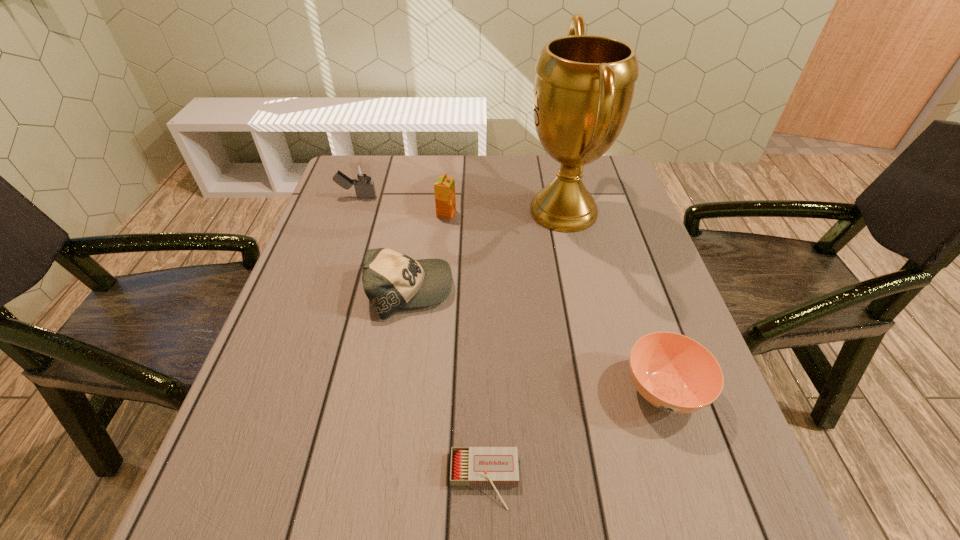
At what (x,y) coordinates should I click in order to perform the action: click on vacant position located on the back of the orange juice. Please return your answer as a coordinate pair (x, y). The height and width of the screenshot is (540, 960). Looking at the image, I should click on pyautogui.click(x=451, y=158).

This screenshot has height=540, width=960. I want to click on vacant region located on the front of the igniter, so click(x=337, y=255).

Find the location of a particular element. The height and width of the screenshot is (540, 960). free space located on the front-facing side of the baseball cap is located at coordinates (479, 290).

This screenshot has width=960, height=540. Find the location of `free point located on the front of the fifth farthest object`. free point located on the front of the fifth farthest object is located at coordinates (703, 510).

Find the location of `trophy cup situated at the far edge`. trophy cup situated at the far edge is located at coordinates (584, 84).

Locate an element on the screen. This screenshot has height=540, width=960. igniter that is at the far edge is located at coordinates (361, 173).

Where is `object at the near edge`? object at the near edge is located at coordinates (470, 466).

I want to click on object that is positioned at the left edge, so click(361, 173).

At what (x,y) coordinates should I click in order to perform the action: click on trophy cup situated at the right edge. Please return your answer as a coordinate pair (x, y). The image size is (960, 540). Looking at the image, I should click on (584, 84).

I want to click on soup bowl that is at the right edge, so click(x=674, y=373).